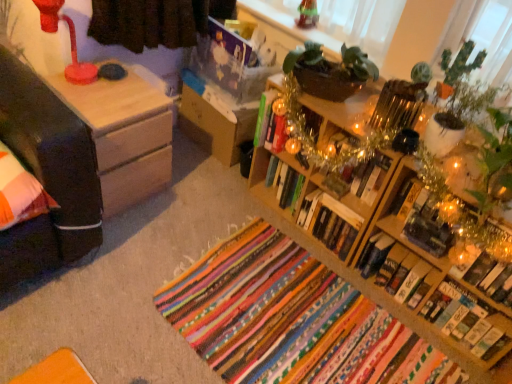
This screenshot has height=384, width=512. What are the coordinates of `blank space to the left of hardcover book at center, positioned as the 1th book in right-to-left order` in the screenshot? It's located at (400, 331).